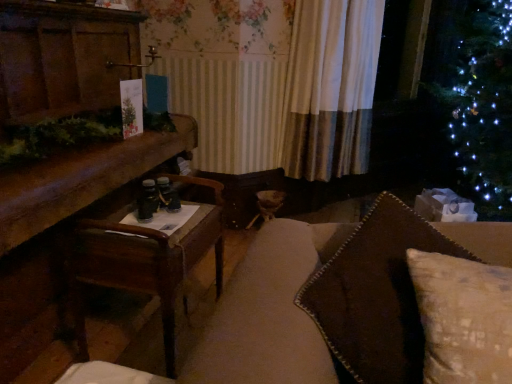
Question: Is wooden table at left facing away from white textured curtain at center?

Choices:
 (A) yes
 (B) no

Answer: (B)

Question: Is wooden table at left completely or partially outside of white textured curtain at center?

Choices:
 (A) no
 (B) yes

Answer: (B)

Question: Is wooden table at left beside white textured curtain at center?

Choices:
 (A) no
 (B) yes

Answer: (A)

Question: Is the depth of wooden table at left less than that of white textured curtain at center?

Choices:
 (A) no
 (B) yes

Answer: (B)

Question: Considering the relative sizes of wooden table at left and white textured curtain at center in the image provided, is wooden table at left taller than white textured curtain at center?

Choices:
 (A) yes
 (B) no

Answer: (B)

Question: From the image's perspective, does wooden table at left appear lower than white textured curtain at center?

Choices:
 (A) yes
 (B) no

Answer: (A)

Question: Is wooden table at left further to the viewer compared to brown textured pillow at right?

Choices:
 (A) no
 (B) yes

Answer: (B)

Question: Does wooden table at left have a larger size compared to brown textured pillow at right?

Choices:
 (A) no
 (B) yes

Answer: (B)

Question: Considering the relative sizes of wooden table at left and brown textured pillow at right in the image provided, is wooden table at left thinner than brown textured pillow at right?

Choices:
 (A) yes
 (B) no

Answer: (B)

Question: Is brown textured pillow at right completely or partially inside wooden table at left?

Choices:
 (A) no
 (B) yes

Answer: (A)

Question: Considering the relative sizes of wooden table at left and brown textured pillow at right in the image provided, is wooden table at left smaller than brown textured pillow at right?

Choices:
 (A) no
 (B) yes

Answer: (A)

Question: Is wooden table at left not near brown textured pillow at right?

Choices:
 (A) yes
 (B) no

Answer: (B)

Question: Is wooden table at left facing towards brown textured pillow at right?

Choices:
 (A) yes
 (B) no

Answer: (A)